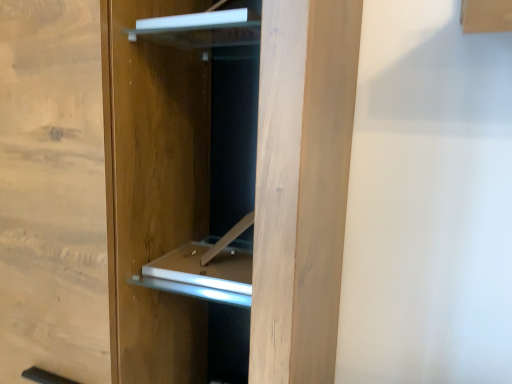
Where is `natural wood door at center`? This screenshot has height=384, width=512. natural wood door at center is located at coordinates (302, 186).

Describe the element at coordinates (302, 186) in the screenshot. I see `natural wood door at center` at that location.

Identify the location of white glossy shelf at upper center. This screenshot has width=512, height=384. (200, 29).

Describe the element at coordinates (200, 29) in the screenshot. I see `white glossy shelf at upper center` at that location.

This screenshot has height=384, width=512. I want to click on natural wood door at center, so click(x=302, y=186).

Between natural wood door at center and white glossy shelf at upper center, which one appears on the right side from the viewer's perspective?

white glossy shelf at upper center.

Considering their positions, is natural wood door at center located in front of or behind white glossy shelf at upper center?

natural wood door at center is positioned closer to the viewer than white glossy shelf at upper center.

Which is closer, (308,249) or (167,28)?

Point (308,249).

From the image's perspective, is natural wood door at center beneath white glossy shelf at upper center?

Yes, from the image's perspective, natural wood door at center is beneath white glossy shelf at upper center.

From a real-world perspective, is natural wood door at center physically located above or below white glossy shelf at upper center?

natural wood door at center is below white glossy shelf at upper center.

Can you confirm if natural wood door at center is thinner than white glossy shelf at upper center?

No.

Considering the sizes of objects natural wood door at center and white glossy shelf at upper center in the image provided, who is taller, natural wood door at center or white glossy shelf at upper center?

natural wood door at center.

Between natural wood door at center and white glossy shelf at upper center, which one has larger size?

Bigger between the two is natural wood door at center.

Looking at this image, is natural wood door at center inside the boundaries of white glossy shelf at upper center, or outside?

natural wood door at center is outside white glossy shelf at upper center.

Are natural wood door at center and white glossy shelf at upper center located far from each other?

natural wood door at center is actually quite close to white glossy shelf at upper center.

Is natural wood door at center oriented away from white glossy shelf at upper center?

Yes, natural wood door at center is facing away from white glossy shelf at upper center.

The width and height of the screenshot is (512, 384). There is a natural wood door at center. Identify the location of cabinet above it (from a real-world perspective). (200, 29).

Is white glossy shelf at upper center to the left of natural wood door at center from the viewer's perspective?

No, white glossy shelf at upper center is not to the left of natural wood door at center.

Considering the positions of objects white glossy shelf at upper center and natural wood door at center in the image provided, who is behind, white glossy shelf at upper center or natural wood door at center?

white glossy shelf at upper center is behind.

Is point (197, 29) more distant than point (328, 43)?

Yes, point (197, 29) is farther from viewer.

From the picture: From the image's perspective, between white glossy shelf at upper center and natural wood door at center, which one is located above?

white glossy shelf at upper center, from the image's perspective.

From a real-world perspective, which object stands above the other?

In real-world perspective, white glossy shelf at upper center is above.

Between white glossy shelf at upper center and natural wood door at center, which one has larger width?

With larger width is natural wood door at center.

Based on the photo, is white glossy shelf at upper center taller than natural wood door at center?

Incorrect, the height of white glossy shelf at upper center is not larger of that of natural wood door at center.

Based on their sizes in the image, would you say white glossy shelf at upper center is bigger or smaller than natural wood door at center?

In the image, white glossy shelf at upper center appears to be smaller than natural wood door at center.

Could natural wood door at center be considered to be inside white glossy shelf at upper center?

No, natural wood door at center is not a part of white glossy shelf at upper center.

Is white glossy shelf at upper center positioned far away from natural wood door at center?

white glossy shelf at upper center is near natural wood door at center, not far away.

Based on the photo, is white glossy shelf at upper center oriented towards natural wood door at center?

Yes, white glossy shelf at upper center faces towards natural wood door at center.

How far apart are white glossy shelf at upper center and natural wood door at center?

white glossy shelf at upper center and natural wood door at center are 9.03 inches apart.

Where is `cabinet behind the natural wood door at center`? The image size is (512, 384). cabinet behind the natural wood door at center is located at coordinates (200, 29).

Where is `cabinet that is above the natural wood door at center (from a real-world perspective)`? cabinet that is above the natural wood door at center (from a real-world perspective) is located at coordinates (200, 29).

Locate an element on the screen. This screenshot has height=384, width=512. cabinet behind the natural wood door at center is located at coordinates (x=200, y=29).